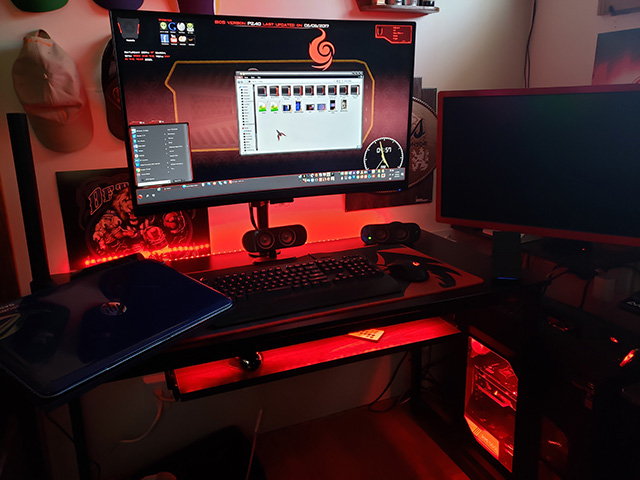
Locate an element on the screen. This screenshot has height=480, width=640. computer is located at coordinates (153, 301), (241, 175), (530, 189).